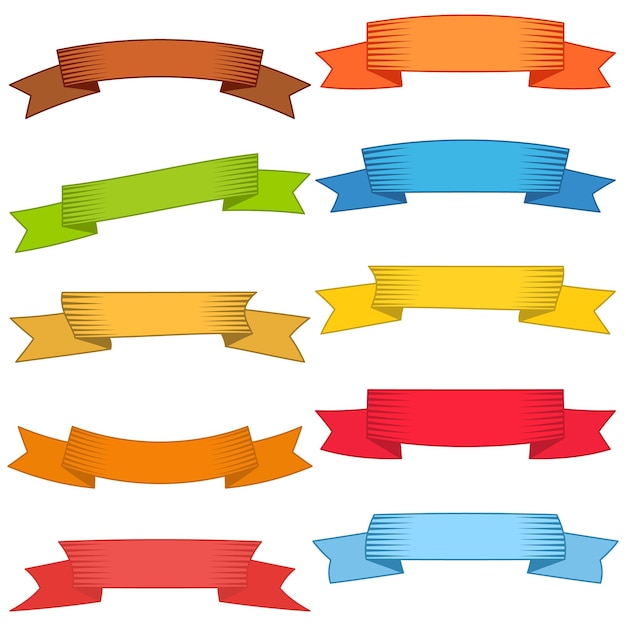
Where is `ribbons/banners`? The height and width of the screenshot is (626, 626). ribbons/banners is located at coordinates (203, 558), (411, 536), (441, 428), (193, 453), (196, 322), (404, 288), (242, 187), (422, 160), (429, 41), (173, 64).